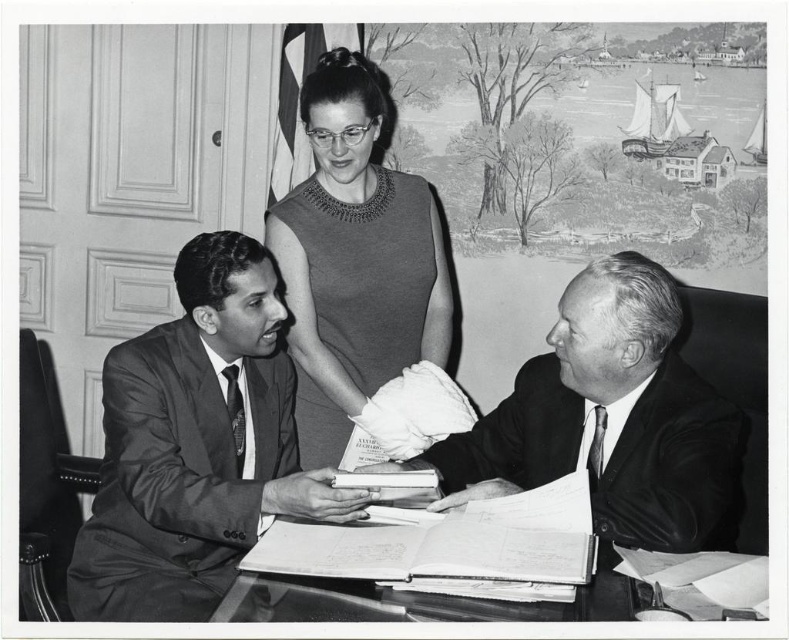
You are a photographer who needs to capture a closeup shot of both the smooth suit at left and the smooth black suit at center. The camera you are using has a maximum focus range of 20 inches. Can you fit both subjects within the focus range?

The smooth suit at left and smooth black suit at center are 19.40 inches apart, so yes, both subjects can be captured within the camera focus range of 20 inches.

In the photograph, where is the smooth suit at left located?

The smooth suit at left is located at point 0.697 on the x axis and 0.250 on the y axis.

You are a photographer who needs to adjust the lighting for the man in the smooth suit at left and the man in the smooth black suit at center. Which man is closer to the camera so you can focus the light there first?

The smooth suit at left is closer to the camera than the smooth black suit at center, so focus the light on the smooth suit at left first.